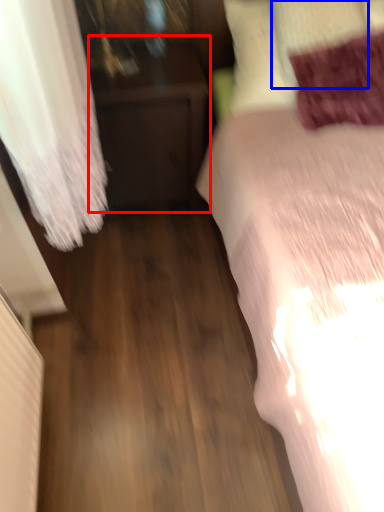
Question: Among these objects, which one is farthest to the camera, furniture (highlighted by a red box) or pillow (highlighted by a blue box)?

Choices:
 (A) furniture
 (B) pillow

Answer: (A)